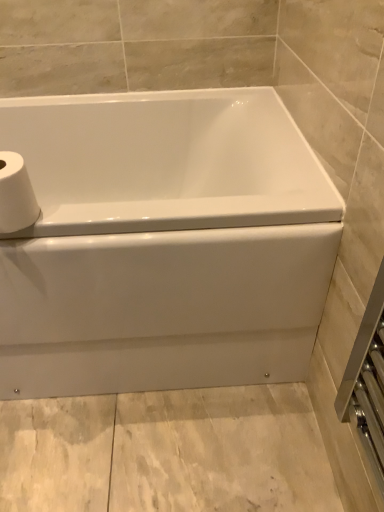
Question: Would you say white matte toilet paper at upper left is inside or outside white glossy bathtub at center?

Choices:
 (A) outside
 (B) inside

Answer: (A)

Question: Visually, is white matte toilet paper at upper left positioned to the left or to the right of white glossy bathtub at center?

Choices:
 (A) left
 (B) right

Answer: (A)

Question: In terms of height, does white matte toilet paper at upper left look taller or shorter compared to white glossy bathtub at center?

Choices:
 (A) tall
 (B) short

Answer: (B)

Question: Looking at the image, does white glossy bathtub at center seem bigger or smaller compared to white matte toilet paper at upper left?

Choices:
 (A) small
 (B) big

Answer: (B)

Question: Considering their positions, is white glossy bathtub at center located in front of or behind white matte toilet paper at upper left?

Choices:
 (A) front
 (B) behind

Answer: (B)

Question: Looking at their shapes, would you say white glossy bathtub at center is wider or thinner than white matte toilet paper at upper left?

Choices:
 (A) wide
 (B) thin

Answer: (A)

Question: Is point (203, 283) closer or farther from the camera than point (9, 176)?

Choices:
 (A) closer
 (B) farther

Answer: (B)